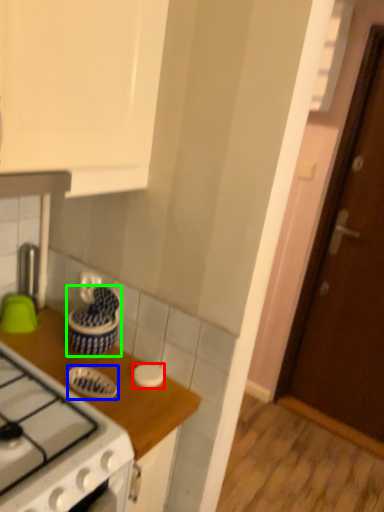
Question: Considering the real-world distances, which object is closest to kitchen appliance (highlighted by a red box)? kitchen appliance (highlighted by a blue box) or kitchen appliance (highlighted by a green box).

Choices:
 (A) kitchen appliance
 (B) kitchen appliance

Answer: (A)